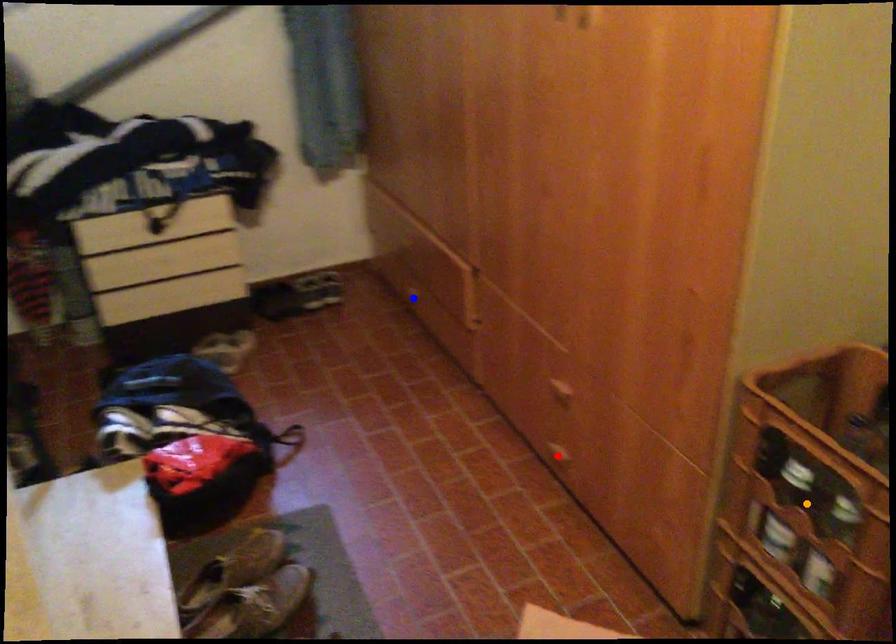
Order these from nearest to farthest:
1. blue point
2. orange point
3. red point

1. blue point
2. red point
3. orange point